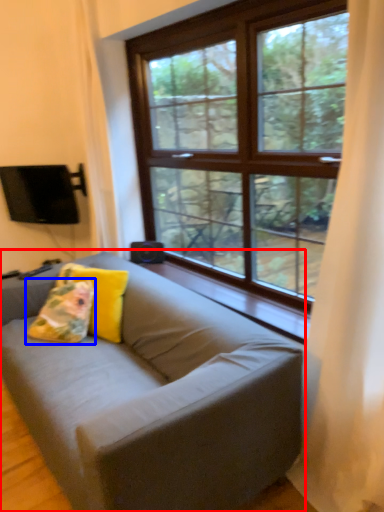
Question: Which object is further to the camera taking this photo, studio couch (highlighted by a red box) or pillow (highlighted by a blue box)?

Choices:
 (A) studio couch
 (B) pillow

Answer: (B)